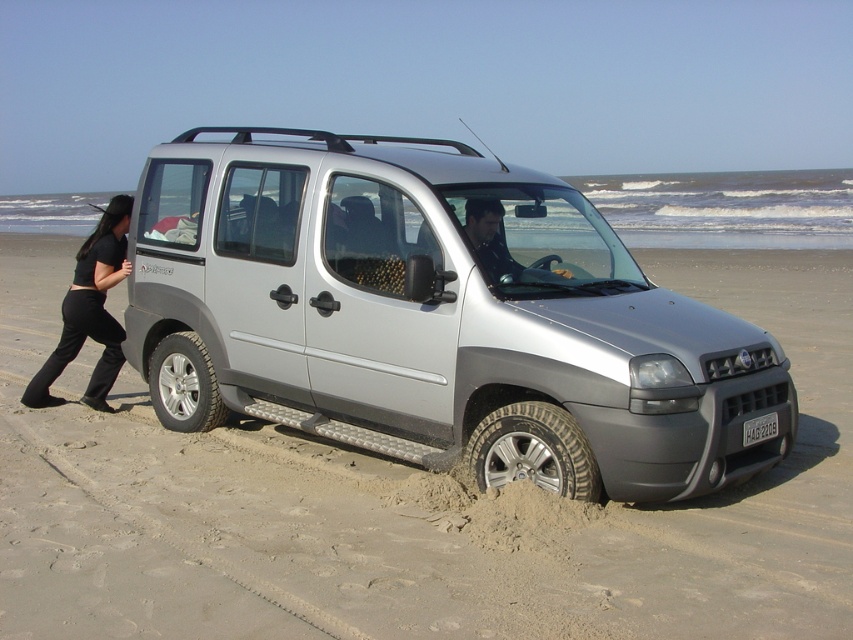
Question: Does satin silver suv at center appear on the left side of silver metallic tire at lower left?

Choices:
 (A) yes
 (B) no

Answer: (B)

Question: Estimate the real-world distances between objects in this image. Which object is closer to the black cotton pants at left?

Choices:
 (A) silver metallic tire at lower left
 (B) sandy gray beach at center

Answer: (A)

Question: Is satin silver suv at center below black cotton pants at left?

Choices:
 (A) yes
 (B) no

Answer: (B)

Question: Can you confirm if satin silver suv at center is smaller than silver metallic tire at lower center?

Choices:
 (A) yes
 (B) no

Answer: (B)

Question: Among these points, which one is nearest to the camera?

Choices:
 (A) (218, 412)
 (B) (503, 451)

Answer: (B)

Question: Which point is farther from the camera taking this photo?

Choices:
 (A) (291, 497)
 (B) (273, 262)
 (C) (524, 432)

Answer: (B)